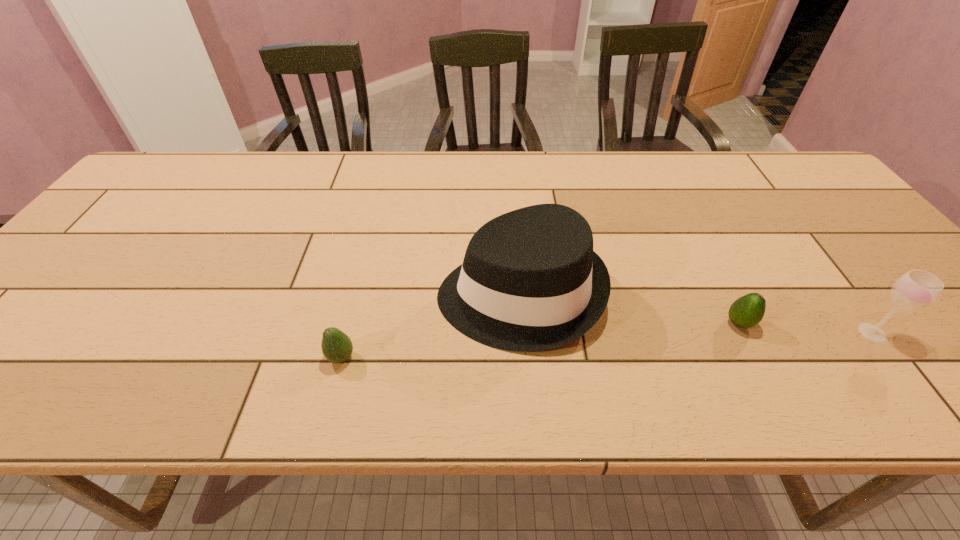
The width and height of the screenshot is (960, 540). I want to click on free space that satisfies the following two spatial constraints: 1. on the front side of the third object from right to left; 2. on the left side of the second object from right to left, so click(x=522, y=323).

Locate an element on the screen. The width and height of the screenshot is (960, 540). free point that satisfies the following two spatial constraints: 1. on the back side of the wineglass; 2. on the left side of the leftmost object is located at coordinates (348, 333).